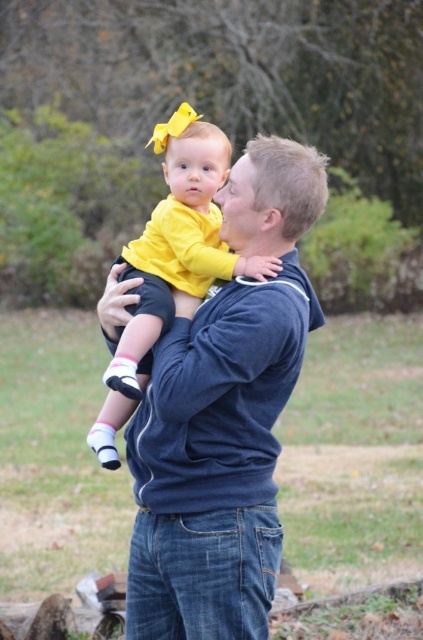
Question: Is blue cotton hoodie at center positioned in front of yellow matte shirt at center?

Choices:
 (A) no
 (B) yes

Answer: (B)

Question: Does blue cotton hoodie at center appear on the right side of yellow matte shirt at center?

Choices:
 (A) no
 (B) yes

Answer: (B)

Question: From the image, what is the correct spatial relationship of blue cotton hoodie at center in relation to yellow matte shirt at center?

Choices:
 (A) left
 (B) right

Answer: (B)

Question: Which point is closer to the camera?

Choices:
 (A) (180, 195)
 (B) (231, 392)

Answer: (B)